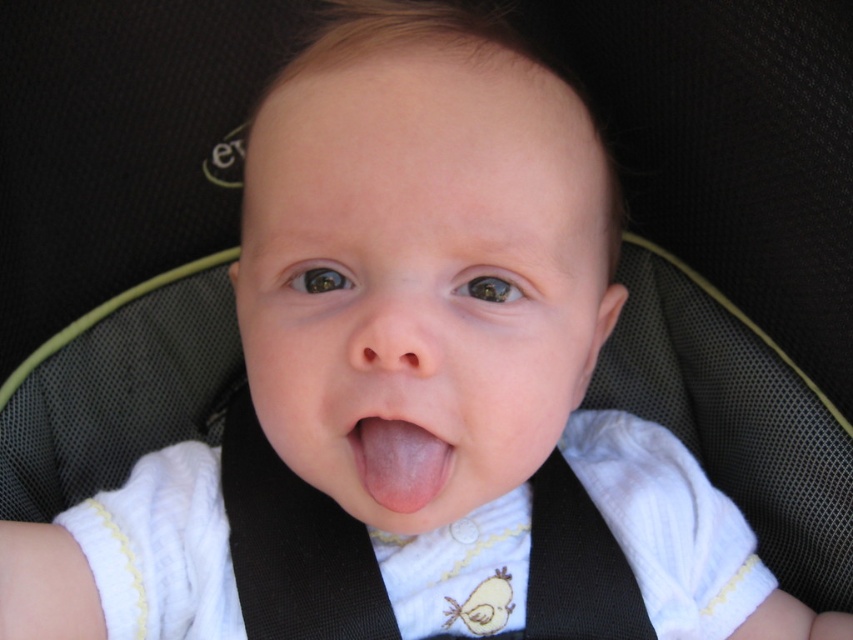
You are a safety inspector checking the car seat installation. You notice a point at coordinate (688,612). According to safety standards, this point should be at least 65 centimeters away from the viewer to ensure proper clearance. Is this installation compliant?

The point at coordinate (688,612) is 66.94 centimeters away from the viewer, which exceeds the minimum requirement of 65 centimeters. Therefore, the installation is compliant with safety standards.

You are a parent trying to clean your baby. You see the white ribbed fabric bib at center and the pink smooth tongue at center. Which object is located on the left side?

The pink smooth tongue at center is on the left side because the white ribbed fabric bib at center is to the right of it.

You are a parent checking the baby in the car seat. You notice the white ribbed fabric bib at center and the pink smooth tongue at center. Is the bib covering the tongue?

The white ribbed fabric bib at center is positioned under the pink smooth tongue at center, so the bib is not covering the tongue.